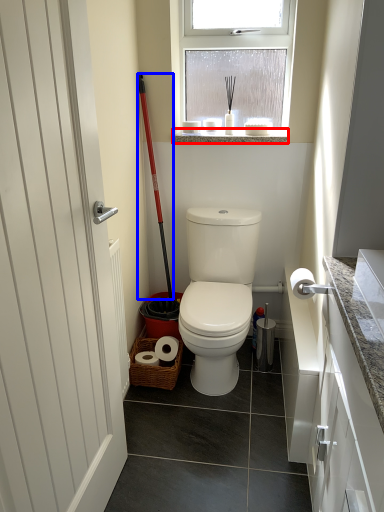
Question: Among these objects, which one is farthest to the camera, window sill (highlighted by a red box) or shovel (highlighted by a blue box)?

Choices:
 (A) window sill
 (B) shovel

Answer: (A)